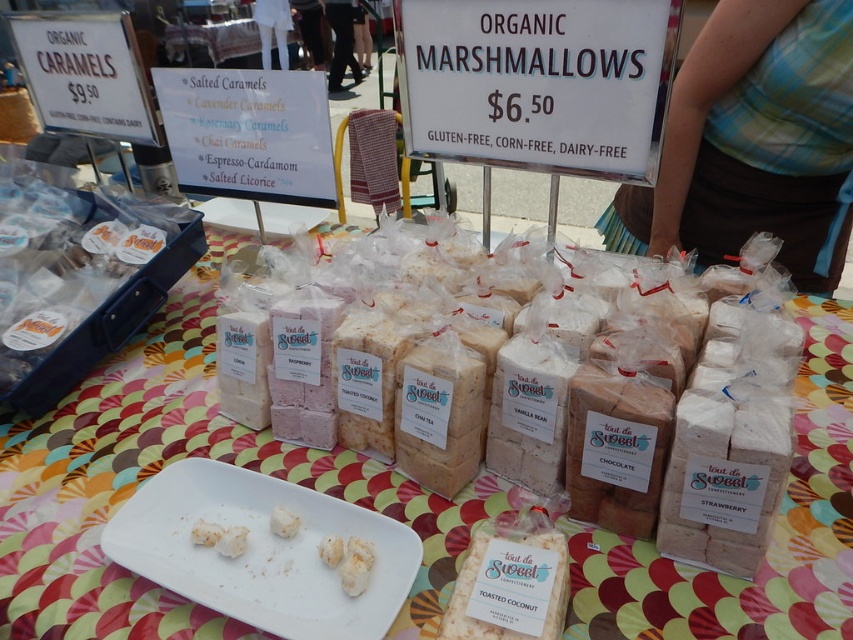
You are a customer at the market and want to buy the white fluffy marshmallow at center. The vendor tells you that the marshmallow is placed on top of the polka dot fabric at center. Can you tell me which item is bigger in size?

The polka dot fabric at center has a larger size compared to the white fluffy marshmallow at center, so the polka dot fabric at center is bigger in size.

You are a customer at the market and want to pick up the polka dot fabric at center. If your hand is 18 inches long, can you reach it?

The distance between you and the polka dot fabric at center is 19.20 inches, so your hand is 18 inches long, so you cannot reach it.